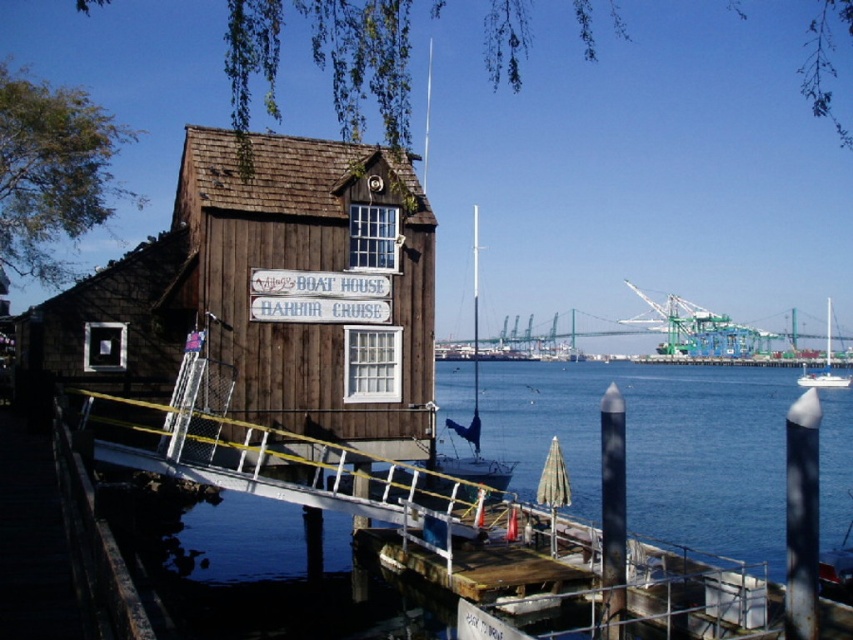
Question: Is white wooden dock at lower center below blue water at lower center?

Choices:
 (A) no
 (B) yes

Answer: (A)

Question: In this image, where is blue water at lower center located relative to white glossy sailboat at right?

Choices:
 (A) above
 (B) below

Answer: (B)

Question: Is white wooden dock at lower center above white matte sailboat at center?

Choices:
 (A) yes
 (B) no

Answer: (B)

Question: Which of the following is the farthest from the observer?

Choices:
 (A) (805, 371)
 (B) (65, 342)
 (C) (276, 474)

Answer: (A)

Question: Considering the real-world distances, which object is farthest from the white wooden dock at lower center?

Choices:
 (A) dark brown wood boat house at center
 (B) blue water at lower center
 (C) white matte sailboat at center

Answer: (B)

Question: Which object is positioned farthest from the blue water at lower center?

Choices:
 (A) white matte sailboat at center
 (B) white wooden dock at lower center
 (C) white glossy sailboat at right
 (D) dark brown wood boat house at center

Answer: (D)